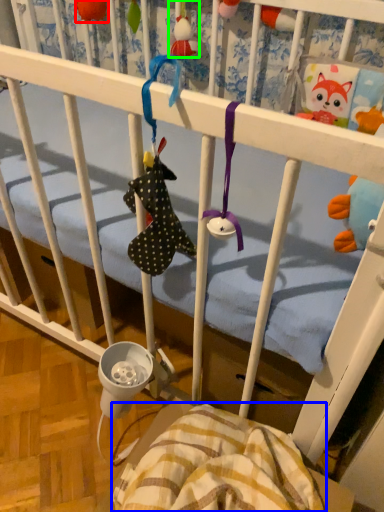
Question: Which object is positioned farthest from toy (highlighted by a red box)? Select from blanket (highlighted by a blue box) and toy (highlighted by a green box).

Choices:
 (A) blanket
 (B) toy

Answer: (A)